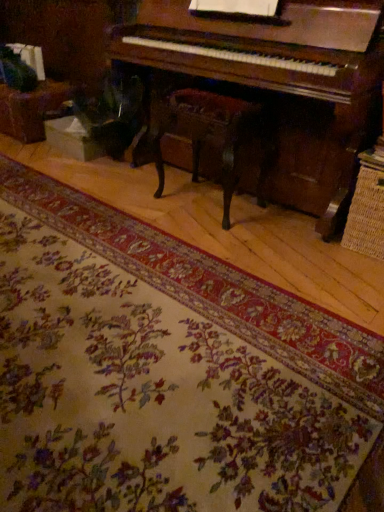
The image size is (384, 512). I want to click on free space below wooden polished chair at center (from a real-world perspective), so click(x=213, y=202).